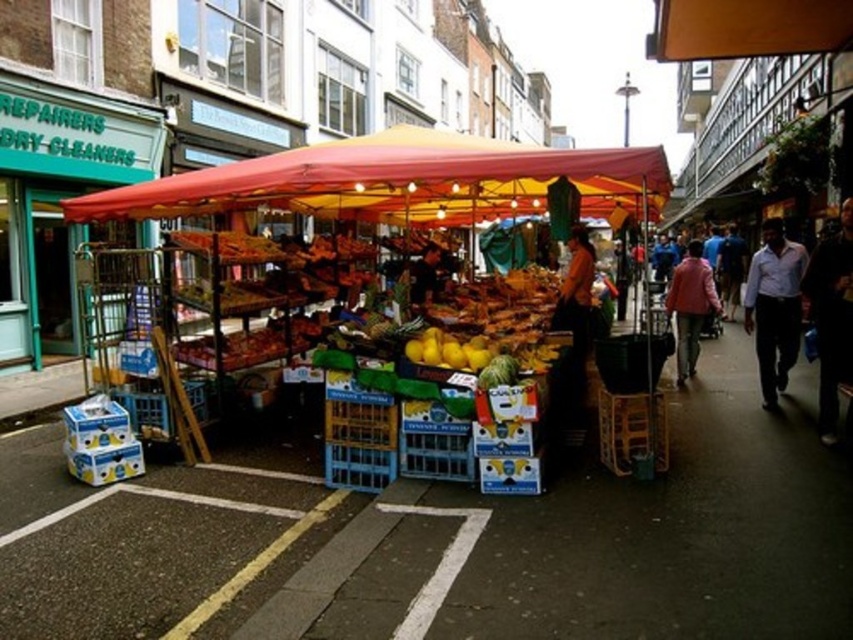
Does matte plastic fruit stand at center appear on the right side of yellow matte lemons at center?

In fact, matte plastic fruit stand at center is to the left of yellow matte lemons at center.

Is point (218, 179) closer to viewer compared to point (436, 332)?

No.

The image size is (853, 640). Identify the location of matte plastic fruit stand at center. (402, 180).

You are a GUI agent. You are given a task and a screenshot of the screen. Output one action in this format:
    pyautogui.click(x=<x>, y=<y>)
    Task: Click on the matte plastic fruit stand at center
    The width and height of the screenshot is (853, 640).
    Given the screenshot: What is the action you would take?
    pyautogui.click(x=402, y=180)

Is white shirt at right closer to camera compared to yellow matte lemons at center?

No, white shirt at right is further to the viewer.

Can you confirm if white shirt at right is bigger than yellow matte lemons at center?

Yes, white shirt at right is bigger than yellow matte lemons at center.

Who is more forward, [786,323] or [448,356]?

Positioned in front is point [448,356].

Where is `white shirt at right`? The height and width of the screenshot is (640, 853). white shirt at right is located at coordinates (775, 307).

Who is positioned more to the left, matte plastic fruit stand at center or dark blue jeans at lower right?

matte plastic fruit stand at center

Between matte plastic fruit stand at center and dark blue jeans at lower right, which one is positioned higher?

matte plastic fruit stand at center is higher up.

This screenshot has height=640, width=853. What do you see at coordinates (402, 180) in the screenshot? I see `matte plastic fruit stand at center` at bounding box center [402, 180].

Where is `matte plastic fruit stand at center`? This screenshot has height=640, width=853. matte plastic fruit stand at center is located at coordinates (402, 180).